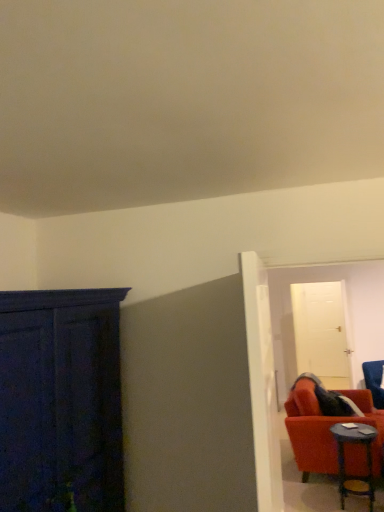
Question: Is white glossy door at upper right, which is the 2th door from front to back, positioned beyond the bounds of white glossy door at center, the second door in the right-to-left sequence?

Choices:
 (A) no
 (B) yes

Answer: (B)

Question: From a real-world perspective, is white glossy door at upper right, positioned as the 1th door in right-to-left order, positioned over white glossy door at center, the second door when ordered from back to front, based on gravity?

Choices:
 (A) yes
 (B) no

Answer: (B)

Question: Does white glossy door at upper right, positioned as the 1th door in right-to-left order, have a smaller size compared to white glossy door at center, acting as the first door starting from the front?

Choices:
 (A) yes
 (B) no

Answer: (B)

Question: From a real-world perspective, is white glossy door at upper right, which is the 2th door from front to back, positioned under white glossy door at center, the second door when ordered from back to front, based on gravity?

Choices:
 (A) yes
 (B) no

Answer: (A)

Question: Is white glossy door at upper right, positioned as the 1th door in right-to-left order, wider than white glossy door at center, the 1th door viewed from the left?

Choices:
 (A) no
 (B) yes

Answer: (B)

Question: Is white glossy door at upper right, positioned as the 1th door in right-to-left order, taller than white glossy door at center, the second door in the right-to-left sequence?

Choices:
 (A) no
 (B) yes

Answer: (B)

Question: Is white glossy door at center, the second door when ordered from back to front, shorter than wooden round table at lower right?

Choices:
 (A) no
 (B) yes

Answer: (A)

Question: Does white glossy door at center, the second door when ordered from back to front, have a greater width compared to wooden round table at lower right?

Choices:
 (A) no
 (B) yes

Answer: (A)

Question: Can we say white glossy door at center, the second door in the right-to-left sequence, lies outside wooden round table at lower right?

Choices:
 (A) yes
 (B) no

Answer: (A)

Question: Does white glossy door at center, the 1th door viewed from the left, have a lesser width compared to wooden round table at lower right?

Choices:
 (A) no
 (B) yes

Answer: (B)

Question: Is white glossy door at center, the second door when ordered from back to front, in front of wooden round table at lower right?

Choices:
 (A) no
 (B) yes

Answer: (B)

Question: Is white glossy door at center, the second door when ordered from back to front, facing towards wooden round table at lower right?

Choices:
 (A) no
 (B) yes

Answer: (A)

Question: From the image's perspective, is velvet blue armchair at right located beneath wooden round table at lower right?

Choices:
 (A) no
 (B) yes

Answer: (B)